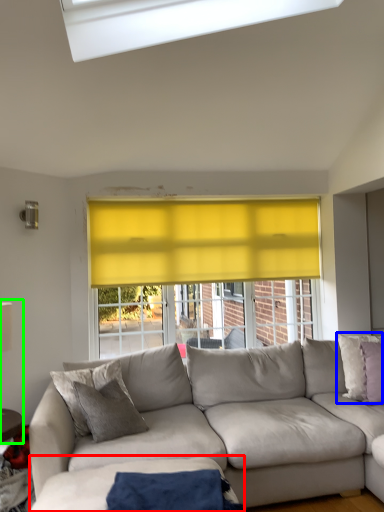
Question: Considering the real-world distances, which object is farthest from plain (highlighted by a red box)? pillow (highlighted by a blue box) or table lamp (highlighted by a green box)?

Choices:
 (A) pillow
 (B) table lamp

Answer: (A)